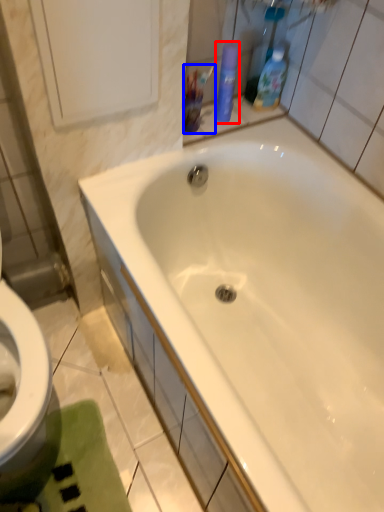
Question: Which of the following is the closest to the observer, cleaning product (highlighted by a red box) or mouthwash (highlighted by a blue box)?

Choices:
 (A) cleaning product
 (B) mouthwash

Answer: (B)